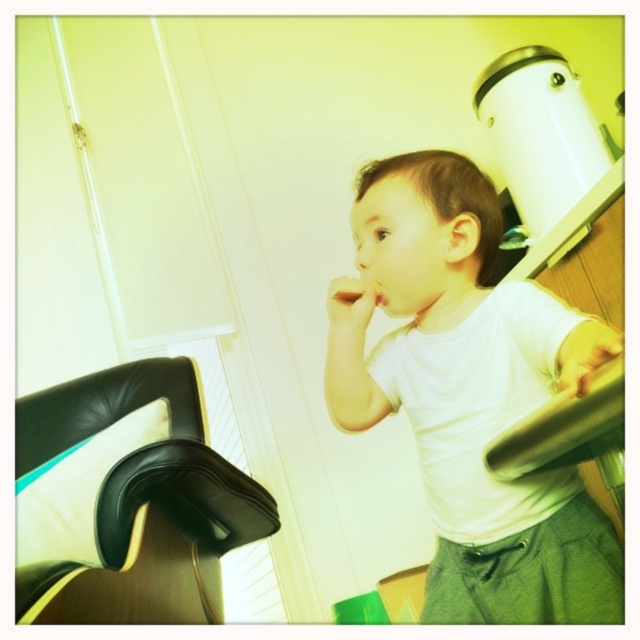
Question: Where is white matte shirt at upper right located in relation to black leather chair at lower left in the image?

Choices:
 (A) left
 (B) right

Answer: (B)

Question: Does white matte shirt at upper right appear on the right side of black leather chair at lower left?

Choices:
 (A) yes
 (B) no

Answer: (A)

Question: Which point is closer to the camera?

Choices:
 (A) black leather chair at lower left
 (B) white matte shirt at upper right

Answer: (B)

Question: Which point appears closest to the camera in this image?

Choices:
 (A) (513, 536)
 (B) (22, 401)

Answer: (A)

Question: Which of the following is the farthest from the observer?

Choices:
 (A) (198, 528)
 (B) (456, 392)

Answer: (A)

Question: Is white matte shirt at upper right positioned before black leather chair at lower left?

Choices:
 (A) no
 (B) yes

Answer: (B)